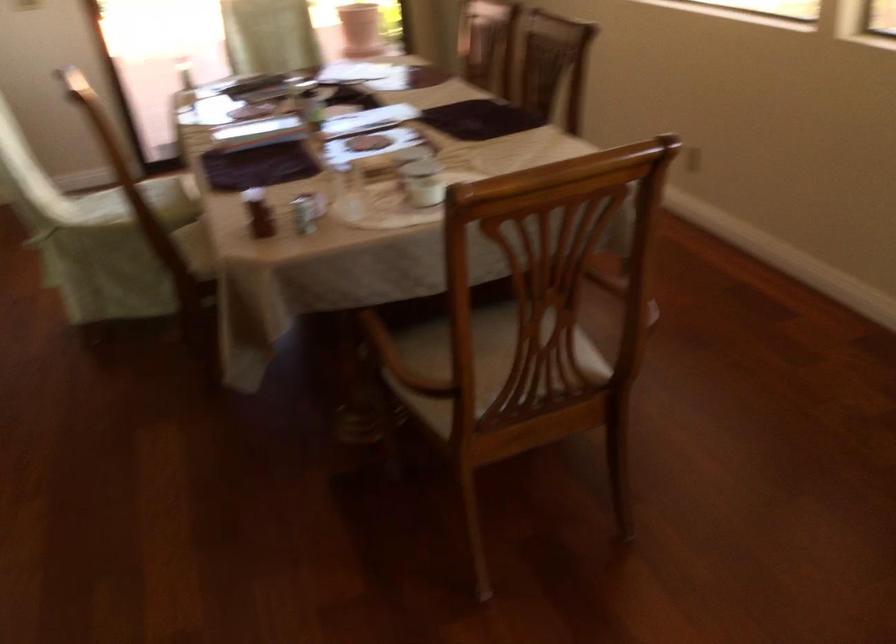
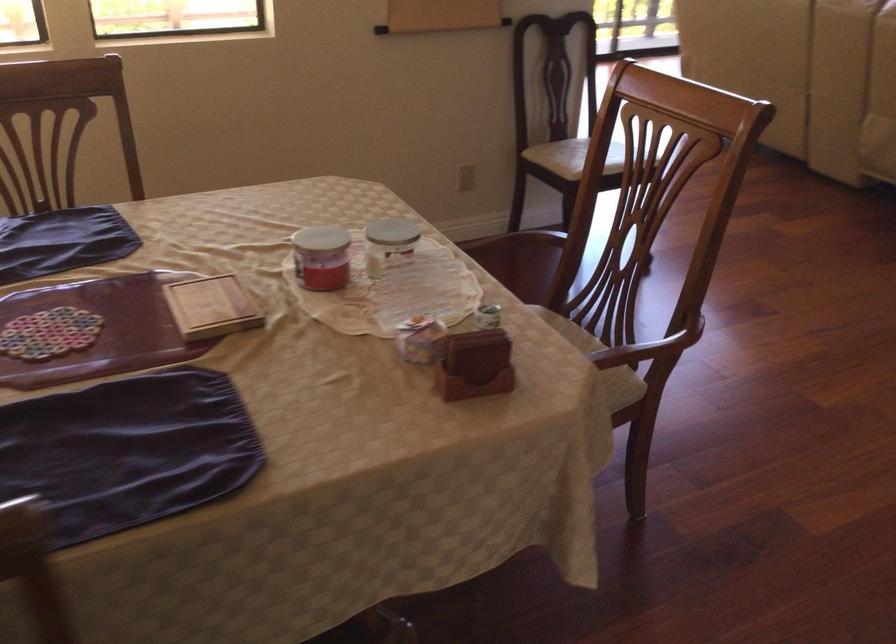
Where in the second image is the point corresponding to pixel 401 164 from the first image?

(321, 257)